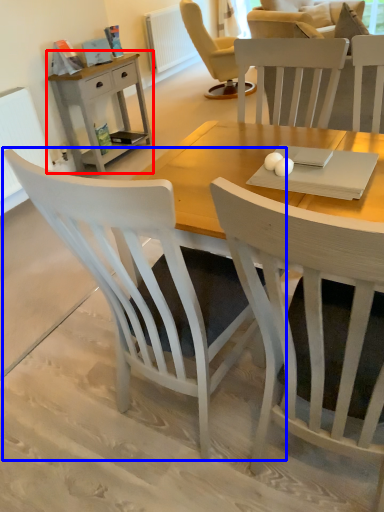
Question: Which point is further to the camera, nightstand (highlighted by a red box) or chair (highlighted by a blue box)?

Choices:
 (A) nightstand
 (B) chair

Answer: (A)